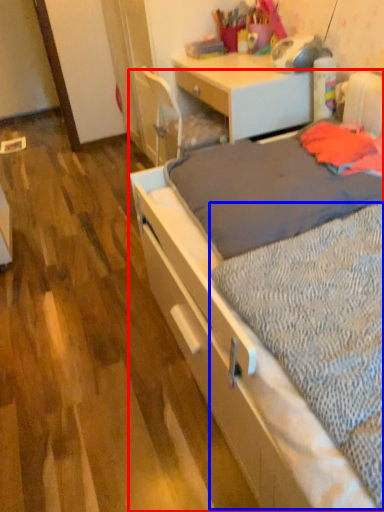
Question: Which object is further to the camera taking this photo, bed (highlighted by a red box) or sheet (highlighted by a blue box)?

Choices:
 (A) bed
 (B) sheet

Answer: (B)